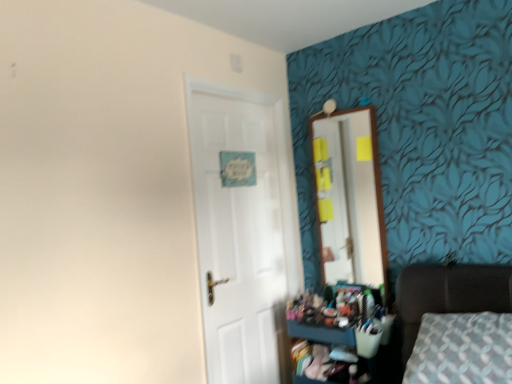
Question: Is dark brown leather bed at lower right shorter than wooden dresser at lower right?

Choices:
 (A) no
 (B) yes

Answer: (A)

Question: Is dark brown leather bed at lower right wider than wooden dresser at lower right?

Choices:
 (A) no
 (B) yes

Answer: (B)

Question: From the image's perspective, is dark brown leather bed at lower right located beneath wooden dresser at lower right?

Choices:
 (A) yes
 (B) no

Answer: (B)

Question: From a real-world perspective, is dark brown leather bed at lower right beneath wooden dresser at lower right?

Choices:
 (A) yes
 (B) no

Answer: (B)

Question: Is dark brown leather bed at lower right behind wooden dresser at lower right?

Choices:
 (A) no
 (B) yes

Answer: (A)

Question: From the image's perspective, is dark brown leather bed at lower right on wooden dresser at lower right?

Choices:
 (A) no
 (B) yes

Answer: (B)

Question: Is wooden dresser at lower right at the left side of wooden mirror at upper right?

Choices:
 (A) yes
 (B) no

Answer: (A)

Question: Can we say wooden dresser at lower right lies outside wooden mirror at upper right?

Choices:
 (A) yes
 (B) no

Answer: (A)

Question: Is wooden mirror at upper right surrounded by wooden dresser at lower right?

Choices:
 (A) yes
 (B) no

Answer: (B)

Question: Considering the relative positions of wooden dresser at lower right and wooden mirror at upper right in the image provided, is wooden dresser at lower right behind wooden mirror at upper right?

Choices:
 (A) yes
 (B) no

Answer: (B)

Question: Does wooden dresser at lower right have a greater height compared to wooden mirror at upper right?

Choices:
 (A) yes
 (B) no

Answer: (B)

Question: Is wooden dresser at lower right not close to wooden mirror at upper right?

Choices:
 (A) yes
 (B) no

Answer: (B)

Question: Considering the relative sizes of white glossy door at center and wooden dresser at lower right in the image provided, is white glossy door at center smaller than wooden dresser at lower right?

Choices:
 (A) yes
 (B) no

Answer: (B)